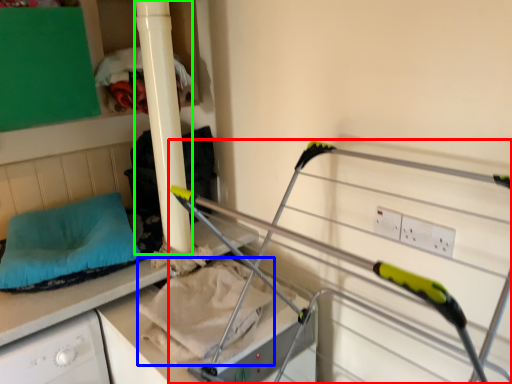
Question: Considering the real-world distances, which object is closest to bunk bed (highlighted by a red box)? sheet (highlighted by a blue box) or pillar (highlighted by a green box).

Choices:
 (A) sheet
 (B) pillar

Answer: (A)